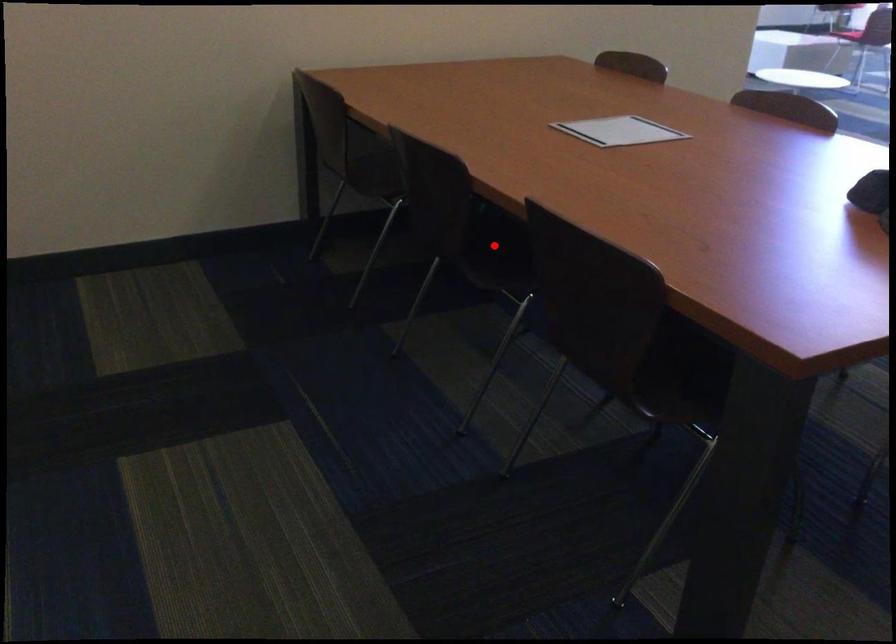
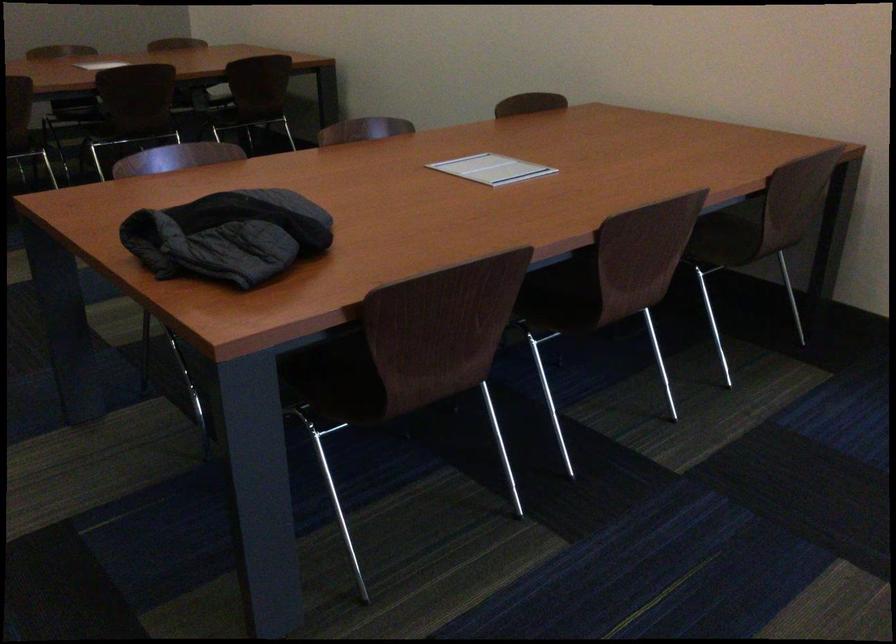
Question: I am providing you with two images of the same scene from different viewpoints. A red point is marked on the first image. Can you still see the location of the red point in image 2?

Choices:
 (A) Yes
 (B) No

Answer: (B)